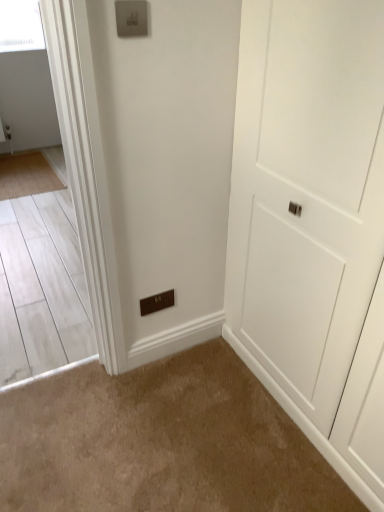
Question: In terms of height, does satin silver switch at upper center, which is the second light switch in bottom-to-top order, look taller or shorter compared to bamboo mat at left?

Choices:
 (A) short
 (B) tall

Answer: (B)

Question: Is point [x=139, y=17] closer or farther from the camera than point [x=41, y=185]?

Choices:
 (A) farther
 (B) closer

Answer: (B)

Question: Which of these objects is positioned closest to the white matte door at center?

Choices:
 (A) satin silver switch at upper center, arranged as the first light switch when viewed from the top
 (B) brown matte switchplate at lower center
 (C) bamboo mat at left
 (D) brown plastic light switch at lower center, the 1th light switch positioned from the back

Answer: (B)

Question: Which is nearer to the white matte door at center?

Choices:
 (A) bamboo mat at left
 (B) brown plastic light switch at lower center, which is the first light switch in bottom-to-top order
 (C) satin silver switch at upper center, the second light switch positioned from the back
 (D) brown matte switchplate at lower center

Answer: (D)